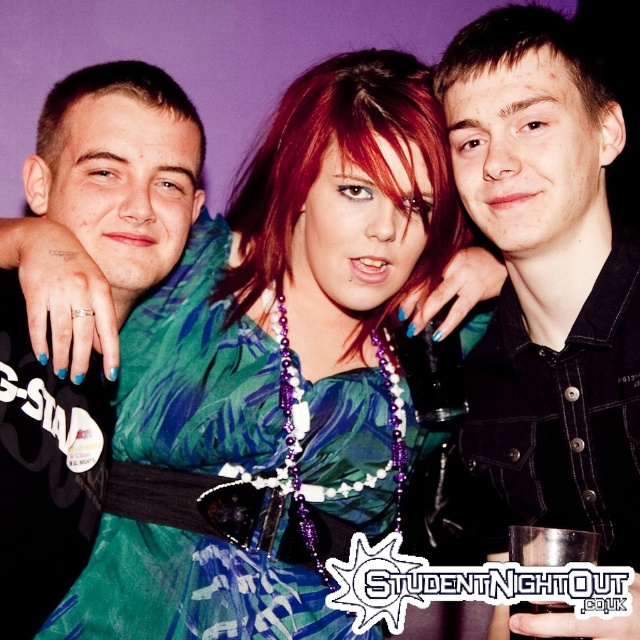
Question: Which object is positioned farthest from the black denim jacket at upper center?

Choices:
 (A) green satin dress at center
 (B) matte black shirt at center

Answer: (B)

Question: Based on their relative distances, which object is farther from the black denim jacket at upper center?

Choices:
 (A) green satin dress at center
 (B) matte black shirt at center

Answer: (B)

Question: Is black denim jacket at upper center above green satin dress at center?

Choices:
 (A) yes
 (B) no

Answer: (A)

Question: Based on their relative distances, which object is farther from the matte black shirt at center?

Choices:
 (A) green satin dress at center
 (B) black denim jacket at upper center

Answer: (B)

Question: Does green satin dress at center come behind matte black shirt at center?

Choices:
 (A) yes
 (B) no

Answer: (A)

Question: Is the position of black denim jacket at upper center more distant than that of matte black shirt at center?

Choices:
 (A) no
 (B) yes

Answer: (B)